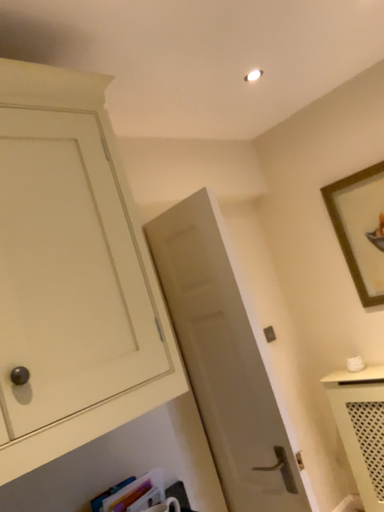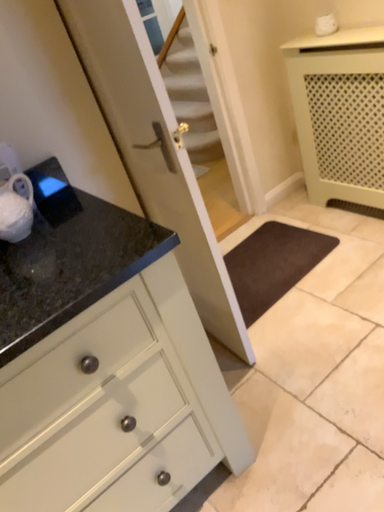
Question: Which way did the camera rotate in the video?

Choices:
 (A) rotated upward
 (B) rotated downward

Answer: (B)